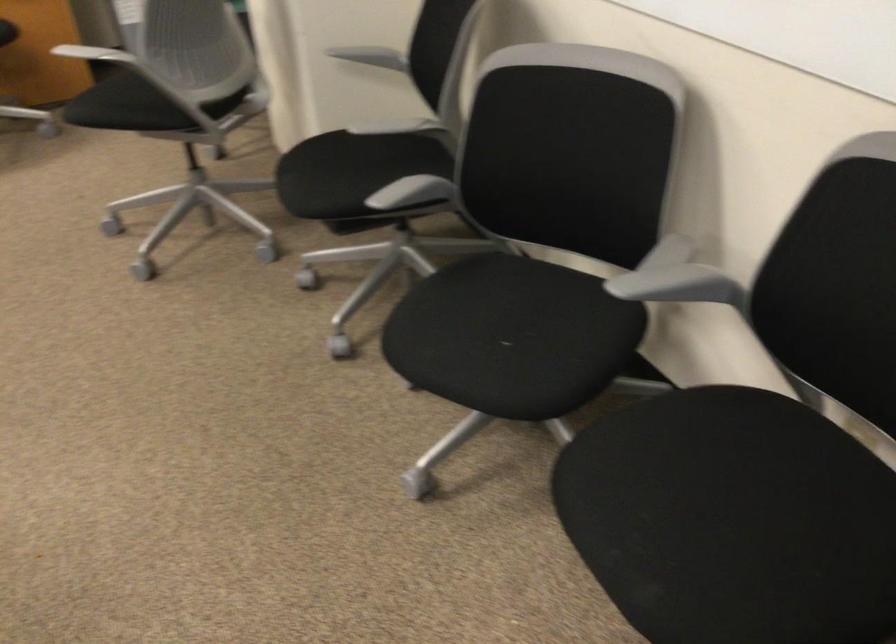
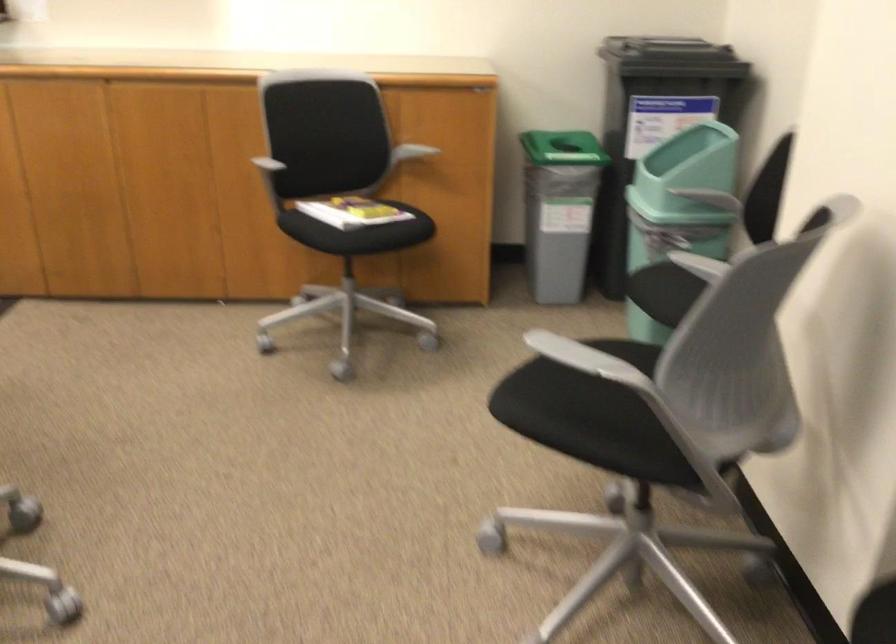
Locate, in the second image, the point that corresponds to point 142,93 in the first image.

(599, 406)